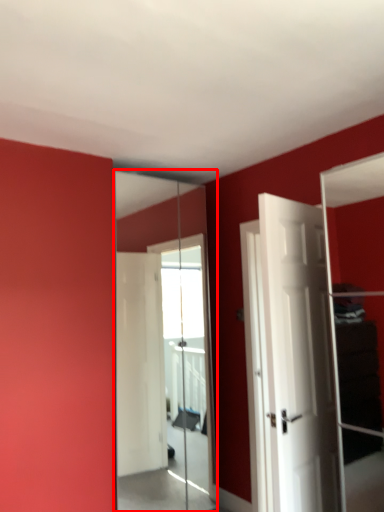
Question: From the image's perspective, where is mirror (annotated by the red box) located in relation to door in the image?

Choices:
 (A) above
 (B) below

Answer: (B)